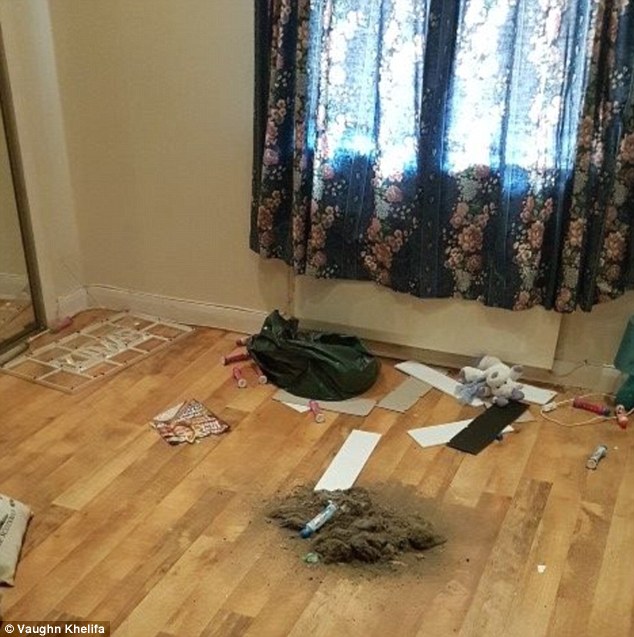
Image resolution: width=634 pixels, height=637 pixels. I want to click on light coming in through window, so [488, 108], [387, 61].